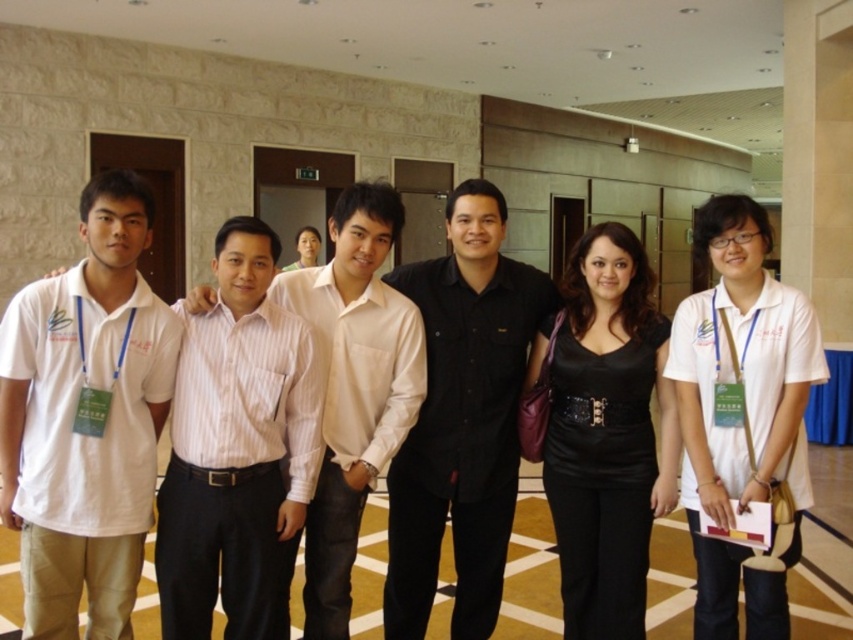
Question: Does black matte shirt at center appear under matte black dress at center?

Choices:
 (A) no
 (B) yes

Answer: (B)

Question: Which object is positioned farthest from the black leather dress at center?

Choices:
 (A) matte black dress at center
 (B) white cotton polo shirt at left

Answer: (A)

Question: Can you confirm if black matte shirt at center is bigger than matte black dress at center?

Choices:
 (A) yes
 (B) no

Answer: (A)

Question: Which object appears closest to the camera in this image?

Choices:
 (A) white cotton shirt at center
 (B) black matte shirt at center
 (C) matte black dress at center

Answer: (A)

Question: Is white cotton shirt at left below black leather dress at center?

Choices:
 (A) yes
 (B) no

Answer: (B)

Question: Which of the following is the closest to the observer?

Choices:
 (A) (355, 257)
 (B) (416, 604)
 (C) (306, 230)

Answer: (A)